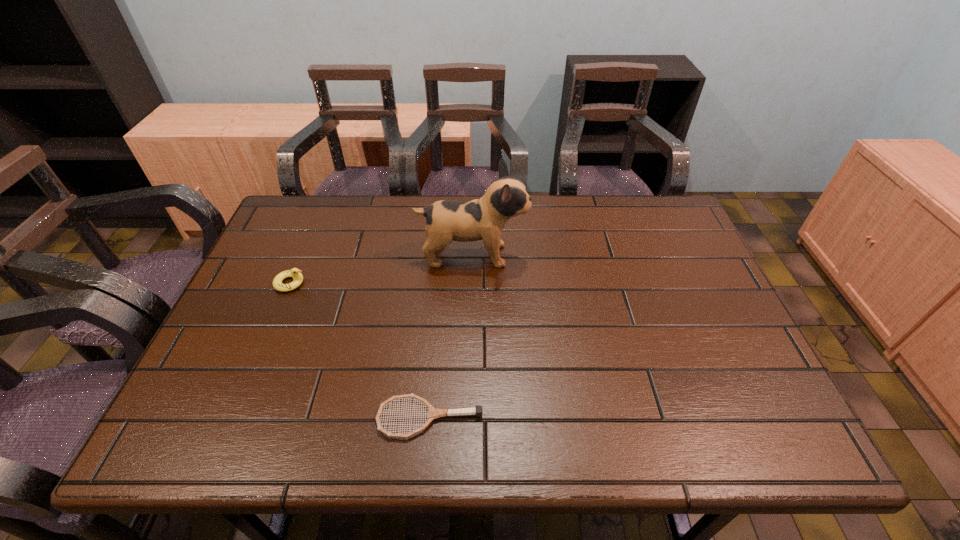
Locate an element on the screen. This screenshot has height=540, width=960. free area in between the farthest object and the second nearest object is located at coordinates (381, 269).

Where is `free spot between the duckling and the nearest object`? Image resolution: width=960 pixels, height=540 pixels. free spot between the duckling and the nearest object is located at coordinates (360, 350).

The image size is (960, 540). Identify the location of empty space between the farthest object and the tennis racket. (451, 336).

Where is `free space between the duckling and the tennis racket`? Image resolution: width=960 pixels, height=540 pixels. free space between the duckling and the tennis racket is located at coordinates (360, 350).

This screenshot has width=960, height=540. What are the coordinates of `empty location between the duckling and the tennis racket` in the screenshot? It's located at (360, 350).

Image resolution: width=960 pixels, height=540 pixels. I want to click on vacant space in between the farthest object and the tennis racket, so [451, 336].

The height and width of the screenshot is (540, 960). Find the location of `vacant region between the second tallest object and the tennis racket`. vacant region between the second tallest object and the tennis racket is located at coordinates (360, 350).

You are a GUI agent. You are given a task and a screenshot of the screen. Output one action in this format:
    pyautogui.click(x=<x>, y=<y>)
    Task: Click on the free space between the shortest object and the tallest object
    The height and width of the screenshot is (540, 960).
    Given the screenshot: What is the action you would take?
    pyautogui.click(x=451, y=336)

Identify which object is located as the second nearest to the shortest object. Please provide its 2D coordinates. Your answer should be formatted as a tuple, i.e. [(x, y)], where the tuple contains the x and y coordinates of a point satisfying the conditions above.

[(295, 273)]

Identify which object is the closest to the puppy. Please provide its 2D coordinates. Your answer should be formatted as a tuple, i.e. [(x, y)], where the tuple contains the x and y coordinates of a point satisfying the conditions above.

[(295, 273)]